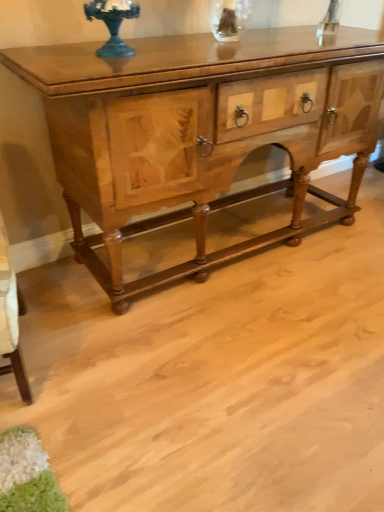
The width and height of the screenshot is (384, 512). In order to click on vacant space in wooden cabinet at center (from a real-world perspective) in this screenshot , I will do `click(225, 236)`.